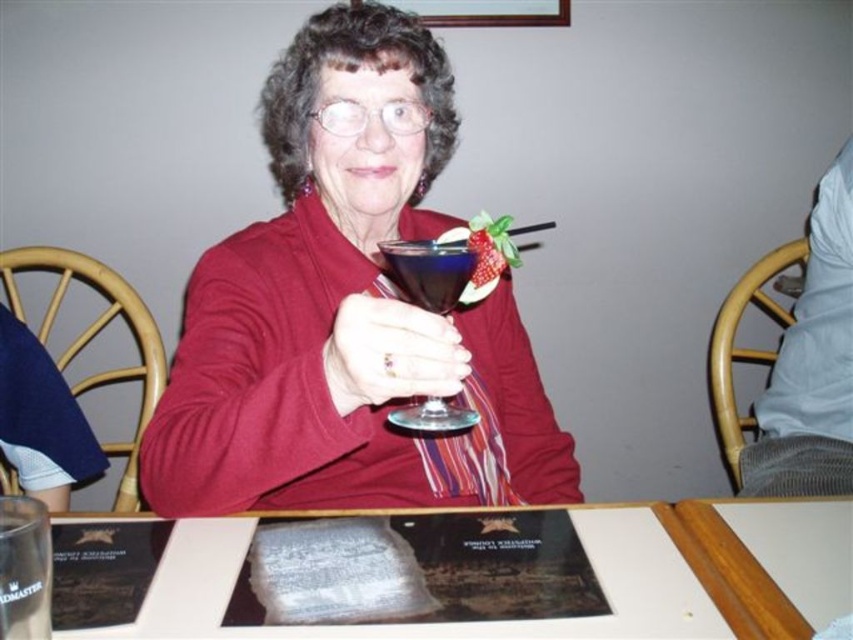
Which of these two, matte glass at center or transparent glass at center, stands shorter?

transparent glass at center

Between matte glass at center and transparent glass at center, which one is positioned higher?

matte glass at center is above.

Describe the element at coordinates (346, 310) in the screenshot. The width and height of the screenshot is (853, 640). I see `matte glass at center` at that location.

Locate an element on the screen. This screenshot has width=853, height=640. matte glass at center is located at coordinates (346, 310).

Can you confirm if wooden table at center is positioned above transparent glass at center?

Incorrect, wooden table at center is not positioned above transparent glass at center.

Can you confirm if wooden table at center is smaller than transparent glass at center?

Correct, wooden table at center occupies less space than transparent glass at center.

Who is more distant from viewer, (749,577) or (437,308)?

The point (437,308) is more distant.

Locate an element on the screen. The width and height of the screenshot is (853, 640). wooden table at center is located at coordinates (772, 561).

Is white textured table at center thinner than wooden table at center?

Incorrect, white textured table at center's width is not less than wooden table at center's.

Who is shorter, white textured table at center or wooden table at center?

With less height is wooden table at center.

Identify the location of white textured table at center. The width and height of the screenshot is (853, 640). (457, 573).